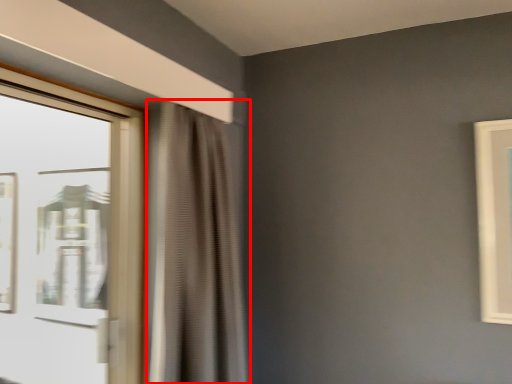
Question: Considering the relative positions of curtain (annotated by the red box) and window in the image provided, where is curtain (annotated by the red box) located with respect to the staircase?

Choices:
 (A) right
 (B) left

Answer: (A)